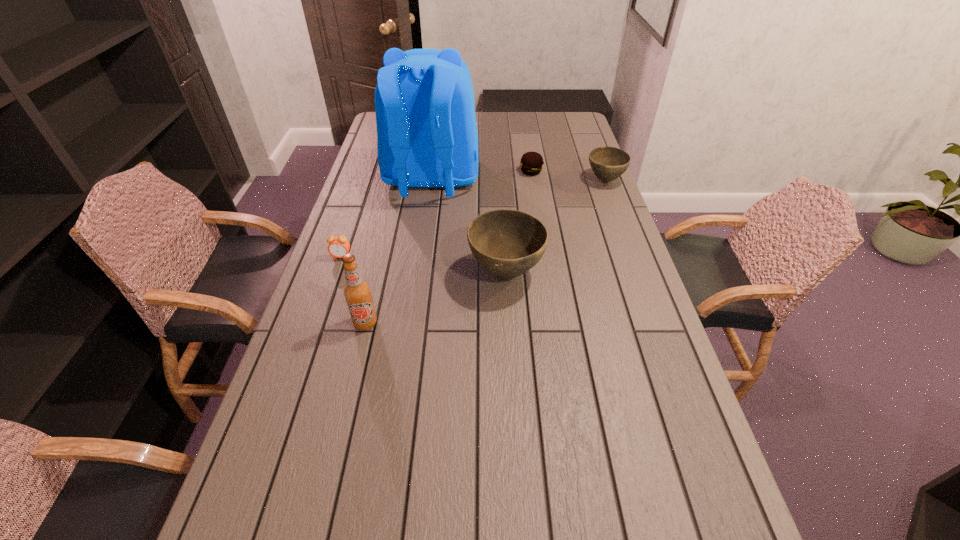
In order to click on free region at the near edge in this screenshot , I will do [605, 467].

This screenshot has width=960, height=540. Identify the location of vacant area at the left edge of the desktop. (348, 351).

Locate an element on the screen. This screenshot has height=540, width=960. vacant space at the right edge is located at coordinates (594, 184).

Where is `vacant space that is in between the shortest object and the farther bowl`? Image resolution: width=960 pixels, height=540 pixels. vacant space that is in between the shortest object and the farther bowl is located at coordinates (568, 176).

This screenshot has width=960, height=540. What are the coordinates of `empty space between the right bowl and the alarm clock` in the screenshot? It's located at (473, 219).

This screenshot has width=960, height=540. I want to click on vacant space that is in between the shortest object and the nearest object, so click(x=448, y=247).

You are a GUI agent. You are given a task and a screenshot of the screen. Output one action in this format:
    pyautogui.click(x=<x>, y=<y>)
    Task: Click on the vacant space that is in between the tallest object and the patty
    
    Given the screenshot: What is the action you would take?
    pyautogui.click(x=481, y=176)

Image resolution: width=960 pixels, height=540 pixels. What are the coordinates of `free spot between the taller bowl and the beer bottle` in the screenshot? It's located at (436, 298).

The image size is (960, 540). I want to click on vacant region between the nearest object and the taller bowl, so click(x=436, y=298).

I want to click on free space between the taller bowl and the leftmost object, so click(423, 265).